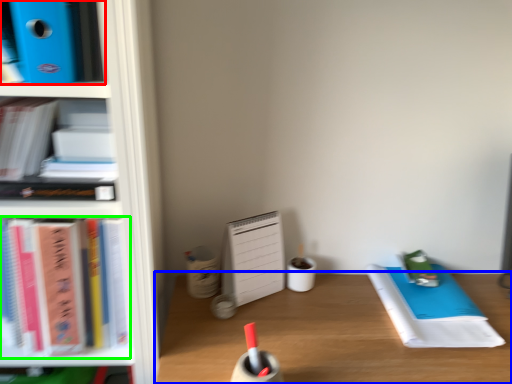
Question: Which object is positioned closest to book (highlighted by a red box)? Select from desk (highlighted by a blue box) and book (highlighted by a green box).

Choices:
 (A) desk
 (B) book

Answer: (B)